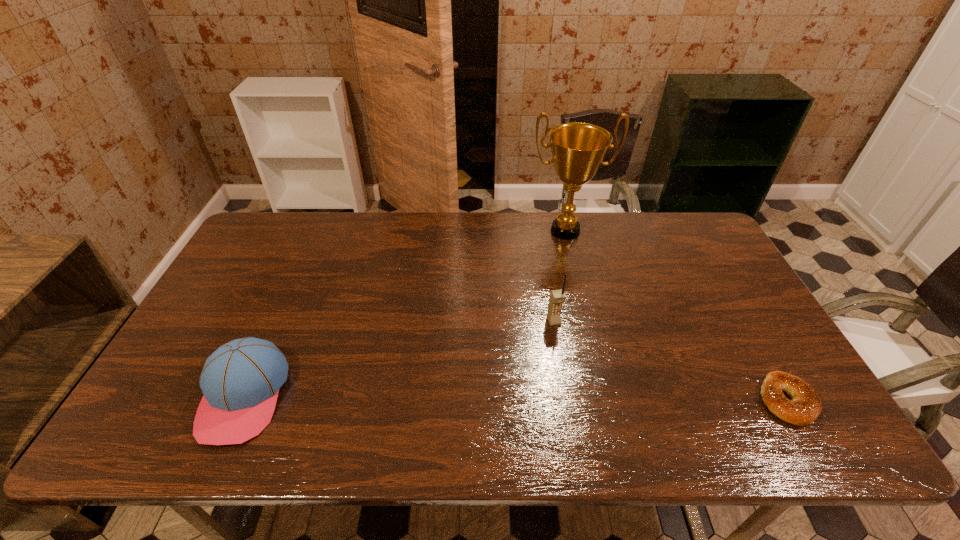
Image resolution: width=960 pixels, height=540 pixels. What are the coordinates of `baseball cap` in the screenshot? It's located at (240, 381).

The width and height of the screenshot is (960, 540). I want to click on the leftmost object, so click(x=240, y=381).

Where is `bagel`? bagel is located at coordinates (804, 408).

Locate an element on the screen. This screenshot has width=960, height=540. the rightmost object is located at coordinates (804, 408).

This screenshot has height=540, width=960. What are the coordinates of `the third nearest object` in the screenshot? It's located at (557, 297).

Image resolution: width=960 pixels, height=540 pixels. In order to click on the third shortest object in this screenshot , I will do `click(557, 297)`.

Where is `the farthest object`? This screenshot has height=540, width=960. the farthest object is located at coordinates (578, 149).

The width and height of the screenshot is (960, 540). Identify the location of the tallest object. (578, 149).

At what (x,y) coordinates should I click in order to perform the action: click on vacant space located 0.140m on the back of the bagel. Please return your answer as a coordinate pair (x, y). The height and width of the screenshot is (540, 960). Looking at the image, I should click on (748, 332).

The width and height of the screenshot is (960, 540). Identify the location of vacant space located 0.210m on the front of the third nearest object, where the keypad is located. (581, 392).